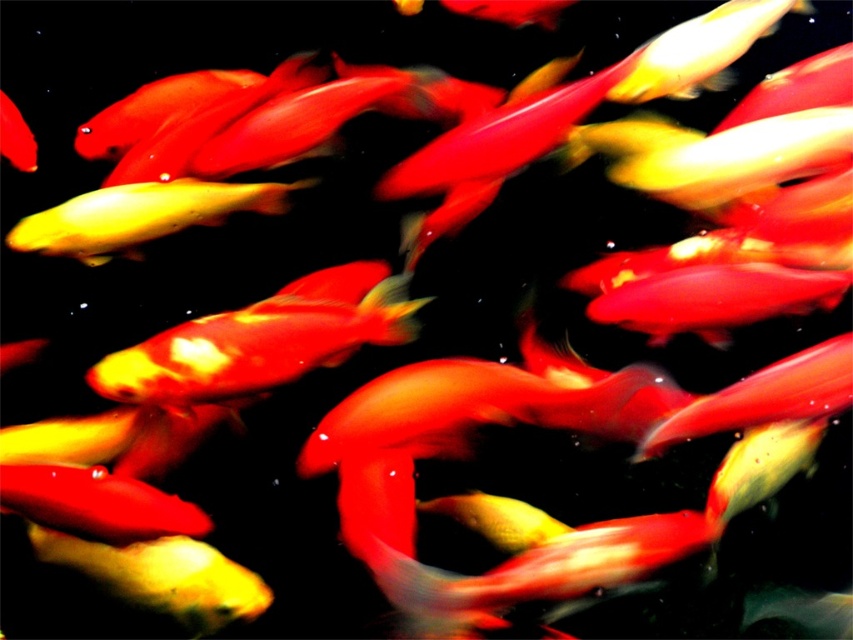
Does yellow glossy fish at left appear over shiny red fish at center?

Incorrect, yellow glossy fish at left is not positioned above shiny red fish at center.

Locate an element on the screen. This screenshot has width=853, height=640. yellow glossy fish at left is located at coordinates (140, 216).

Find the location of `shiny goldfish at center`. shiny goldfish at center is located at coordinates (254, 346).

Which is above, shiny goldfish at center or yellow glossy fish at left?

Positioned higher is yellow glossy fish at left.

Find the location of a particular element. The image size is (853, 640). shiny goldfish at center is located at coordinates (254, 346).

Which is below, shiny goldfish at center or shiny red fish at center?

shiny goldfish at center

Can you confirm if shiny goldfish at center is positioned below shiny red fish at center?

Correct, shiny goldfish at center is located below shiny red fish at center.

Is point (115, 397) positioned behind point (0, 138)?

No, it is in front of (0, 138).

You are a GUI agent. You are given a task and a screenshot of the screen. Output one action in this format:
    pyautogui.click(x=<x>, y=<y>)
    Task: Click on the shiny goldfish at center
    The height and width of the screenshot is (640, 853).
    Given the screenshot: What is the action you would take?
    pyautogui.click(x=254, y=346)